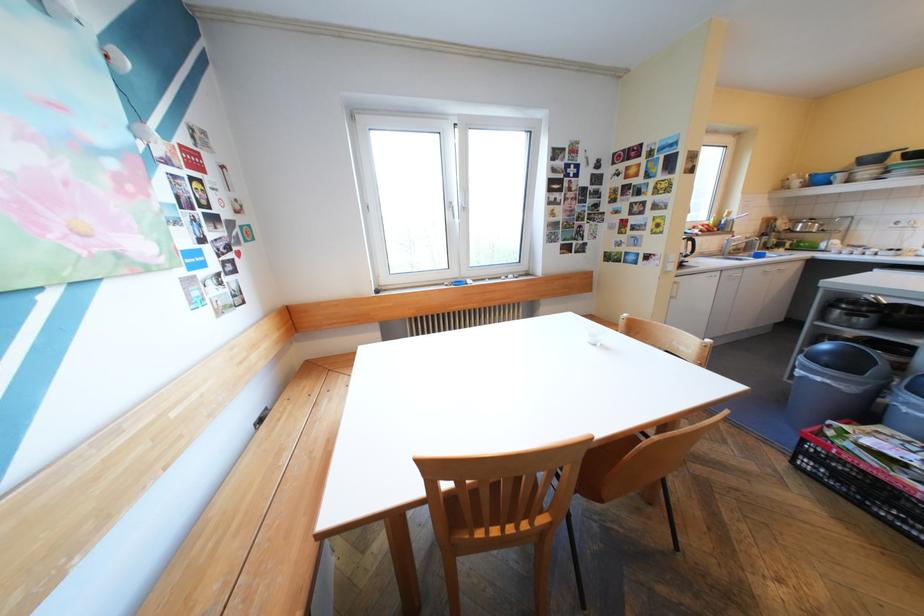
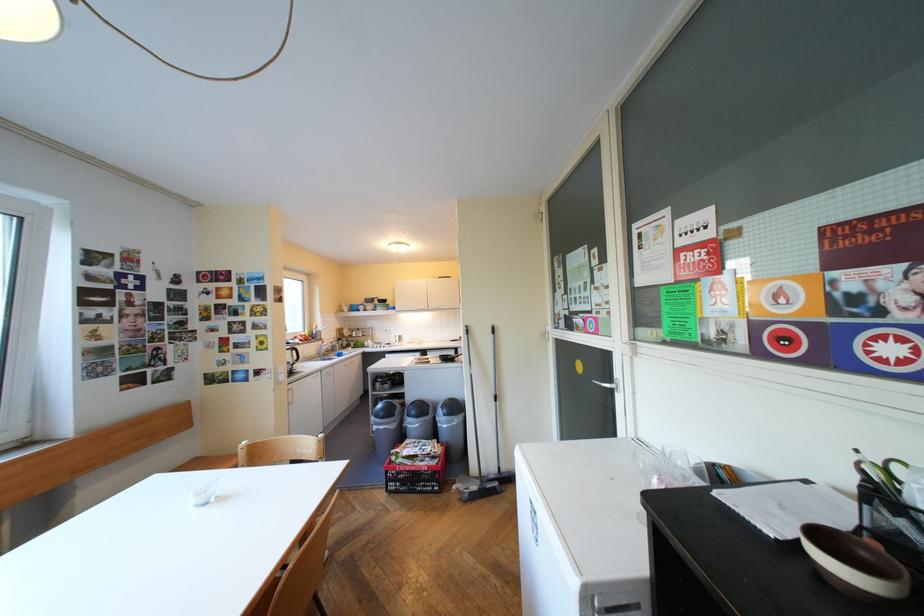
Locate, in the second image, the point that corresponds to (x=721, y=241) in the first image.

(321, 349)